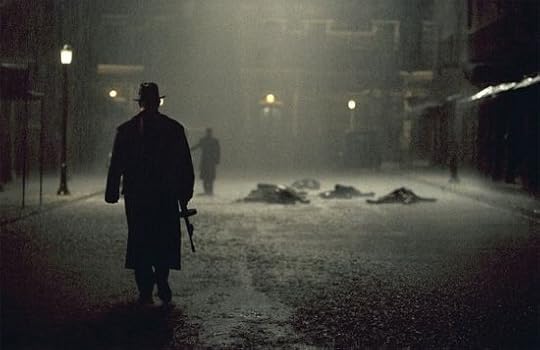
This screenshot has height=350, width=540. I want to click on coat, so click(x=148, y=138), click(x=202, y=148).